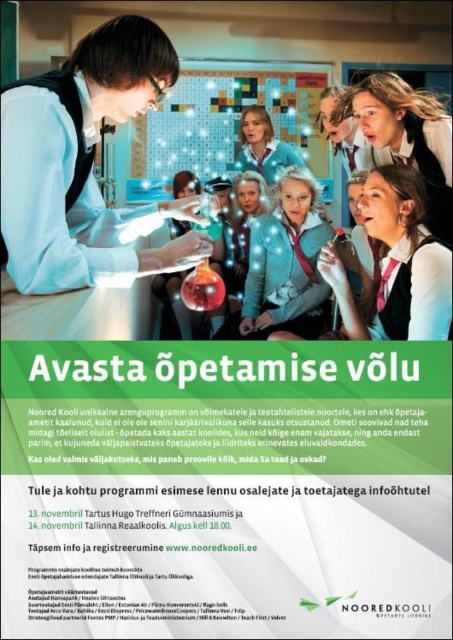
Question: Can you confirm if white paper at center is positioned below matte black lab coat at center?

Choices:
 (A) yes
 (B) no

Answer: (A)

Question: Which of the following is the closest to the observer?

Choices:
 (A) [193, 83]
 (B) [193, 476]
 (C) [47, 285]

Answer: (B)

Question: Which point is closer to the camera taking this photo?

Choices:
 (A) (305, 451)
 (B) (439, 244)
 (C) (44, 225)
 (D) (153, 196)

Answer: (A)

Question: Is white paper at center positioned at the back of metallic silver bulletin board at center?

Choices:
 (A) no
 (B) yes

Answer: (A)

Question: Which point is farther to the camera?

Choices:
 (A) white fabric shirt at upper right
 (B) white paper at center
 (C) matte black lab coat at center
 (D) metallic silver bulletin board at center

Answer: (D)

Question: In this image, where is white paper at center located relative to metallic silver bulletin board at center?

Choices:
 (A) below
 (B) above

Answer: (A)